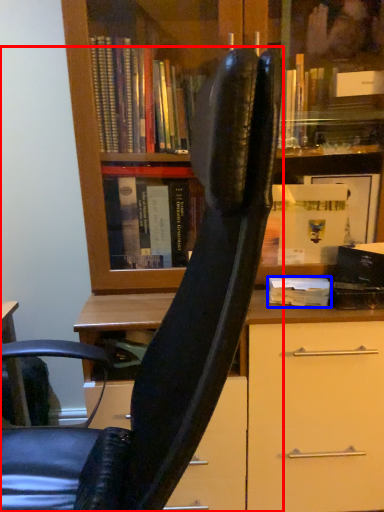
Question: Which object appears closest to the camera in this image, chair (highlighted by a red box) or book (highlighted by a blue box)?

Choices:
 (A) chair
 (B) book

Answer: (A)